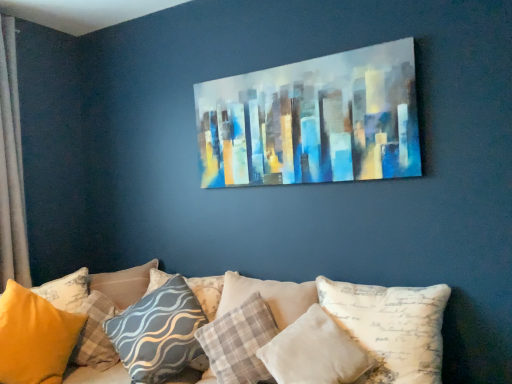
Measure the distance between point (139,360) and camera.

They are 6.73 feet apart.

Find the location of a particular element. Image resolution: width=512 pixels, height=384 pixels. textured gray pillow at center, marked as the 5th pillow in a right-to-left arrangement is located at coordinates (158, 333).

How much space does plaid fabric pillow at center, acting as the 5th pillow starting from the left, occupy horizontally?

plaid fabric pillow at center, acting as the 5th pillow starting from the left, is 17.67 inches wide.

In order to face white velvety pillow at center, arranged as the 6th pillow when viewed from the left, should I rotate leftwards or rightwards?

To align with it, rotate right about 7.085°.

Locate an element on the screen. The image size is (512, 384). white fabric pillow at center, which is the first pillow from right to left is located at coordinates pyautogui.click(x=391, y=327).

Measure the distance between point (371, 314) and camera.

1.84 meters.

Image resolution: width=512 pixels, height=384 pixels. Identify the location of abstract acrylic cityscape at upper center. pos(313,120).

Identify the location of gray wavy-patterned pillow at center, the 4th pillow when ordered from left to right. (207, 292).

Where is `matte yellow pillow at lower left, acting as the seventh pillow starting from the right`? This screenshot has width=512, height=384. matte yellow pillow at lower left, acting as the seventh pillow starting from the right is located at coordinates (87, 319).

How different are the orientations of abstract acrylic cityscape at upper center and yellow fabric pillow at lower left, placed as the sixth pillow when sorted from right to left, in degrees?

The angular difference between abstract acrylic cityscape at upper center and yellow fabric pillow at lower left, placed as the sixth pillow when sorted from right to left, is 30.9 degrees.

From the image's perspective, which object appears higher, abstract acrylic cityscape at upper center or yellow fabric pillow at lower left, placed as the sixth pillow when sorted from right to left?

From the image's view, abstract acrylic cityscape at upper center is above.

Which of these two, abstract acrylic cityscape at upper center or yellow fabric pillow at lower left, which ranks as the second pillow in left-to-right order, is smaller?

Smaller between the two is yellow fabric pillow at lower left, which ranks as the second pillow in left-to-right order.

From the picture: Between abstract acrylic cityscape at upper center and yellow fabric pillow at lower left, which ranks as the second pillow in left-to-right order, which one is positioned in front?

Positioned in front is abstract acrylic cityscape at upper center.

Locate an element on the screen. curtain above the white velvety pillow at center, arranged as the 6th pillow when viewed from the left (from the image's perspective) is located at coordinates (11, 166).

From the image's perspective, is silky beige curtain at left below white velvety pillow at center, arranged as the 6th pillow when viewed from the left?

No.

Is silky beige curtain at left in contact with white velvety pillow at center, arranged as the 6th pillow when viewed from the left?

No, silky beige curtain at left is not making contact with white velvety pillow at center, arranged as the 6th pillow when viewed from the left.

Is silky beige curtain at left taller or shorter than white velvety pillow at center, the second pillow when ordered from right to left?

In the image, silky beige curtain at left appears to be taller than white velvety pillow at center, the second pillow when ordered from right to left.

Is point (128, 338) more distant than point (57, 307)?

No, it is not.

How many degrees apart are the facing directions of textured gray pillow at center, the 3th pillow viewed from the left, and matte yellow pillow at lower left, placed as the first pillow when sorted from left to right?

66.9 degrees.

Based on the photo, from a real-world perspective, is textured gray pillow at center, the 3th pillow viewed from the left, physically located above or below matte yellow pillow at lower left, acting as the seventh pillow starting from the right?

From a real-world perspective, textured gray pillow at center, the 3th pillow viewed from the left, is physically above matte yellow pillow at lower left, acting as the seventh pillow starting from the right.

Between textured gray pillow at center, marked as the 5th pillow in a right-to-left arrangement, and matte yellow pillow at lower left, acting as the seventh pillow starting from the right, which one has larger width?

Wider between the two is matte yellow pillow at lower left, acting as the seventh pillow starting from the right.

Which is closer, (394,41) or (265,314)?

Positioned in front is point (394,41).

You are a GUI agent. You are given a task and a screenshot of the screen. Output one action in this format:
    pyautogui.click(x=<x>, y=<y>)
    Task: Click on the oil painting on the right of plaid fabric pillow at center, acting as the third pillow starting from the right
    This screenshot has width=512, height=384.
    Given the screenshot: What is the action you would take?
    pyautogui.click(x=313, y=120)

Is abstract acrylic cityscape at upper center at the left side of plaid fabric pillow at center, acting as the 5th pillow starting from the left?

No.

Is abstract acrylic cityscape at upper center oriented towards plaid fabric pillow at center, acting as the third pillow starting from the right?

No, abstract acrylic cityscape at upper center does not turn towards plaid fabric pillow at center, acting as the third pillow starting from the right.

From the image's perspective, is plaid fabric pillow at center, acting as the third pillow starting from the right, above or below matte yellow pillow at lower left, placed as the first pillow when sorted from left to right?

From the image's perspective, plaid fabric pillow at center, acting as the third pillow starting from the right, appears above matte yellow pillow at lower left, placed as the first pillow when sorted from left to right.

Between plaid fabric pillow at center, acting as the 5th pillow starting from the left, and matte yellow pillow at lower left, placed as the first pillow when sorted from left to right, which one appears on the left side from the viewer's perspective?

Positioned to the left is matte yellow pillow at lower left, placed as the first pillow when sorted from left to right.

From a real-world perspective, is plaid fabric pillow at center, acting as the 5th pillow starting from the left, physically above matte yellow pillow at lower left, placed as the first pillow when sorted from left to right?

No, from a real-world perspective, plaid fabric pillow at center, acting as the 5th pillow starting from the left, is not over matte yellow pillow at lower left, placed as the first pillow when sorted from left to right

Which object is further away from the camera, gray wavy-patterned pillow at center, the 4th pillow from the right, or abstract acrylic cityscape at upper center?

Positioned behind is gray wavy-patterned pillow at center, the 4th pillow from the right.

Locate an element on the screen. oil painting above the gray wavy-patterned pillow at center, the 4th pillow from the right (from a real-world perspective) is located at coordinates (313, 120).

From the image's perspective, is gray wavy-patterned pillow at center, the 4th pillow from the right, above or below abstract acrylic cityscape at upper center?

Based on their image positions, gray wavy-patterned pillow at center, the 4th pillow from the right, is located beneath abstract acrylic cityscape at upper center.

Is matte yellow pillow at lower left, acting as the seventh pillow starting from the right, far away from white fabric pillow at center, the seventh pillow viewed from the left?

That's right, there is a large distance between matte yellow pillow at lower left, acting as the seventh pillow starting from the right, and white fabric pillow at center, the seventh pillow viewed from the left.

From the image's perspective, is matte yellow pillow at lower left, placed as the first pillow when sorted from left to right, under white fabric pillow at center, which is the first pillow from right to left?

Yes.

From a real-world perspective, between matte yellow pillow at lower left, placed as the first pillow when sorted from left to right, and white fabric pillow at center, the seventh pillow viewed from the left, who is vertically higher?

white fabric pillow at center, the seventh pillow viewed from the left, is physically above.

Does matte yellow pillow at lower left, placed as the first pillow when sorted from left to right, come behind white fabric pillow at center, which is the first pillow from right to left?

That is True.

The height and width of the screenshot is (384, 512). Find the location of `oil painting in front of the yellow fabric pillow at lower left, placed as the sixth pillow when sorted from right to left`. oil painting in front of the yellow fabric pillow at lower left, placed as the sixth pillow when sorted from right to left is located at coordinates (313, 120).

From the image's perspective, count 4th pillows downward from the silky beige curtain at left and point to it. Please provide its 2D coordinates.

[(314, 352)]

From the picture: Looking at the image, which one is located closer to abstract acrylic cityscape at upper center, white velvety pillow at center, the second pillow when ordered from right to left, or white fabric pillow at center, the seventh pillow viewed from the left?

Among the two, white fabric pillow at center, the seventh pillow viewed from the left, is located nearer to abstract acrylic cityscape at upper center.

Based on their spatial positions, is textured gray pillow at center, the 3th pillow viewed from the left, or plaid fabric pillow at center, acting as the third pillow starting from the right, closer to silky beige curtain at left?

textured gray pillow at center, the 3th pillow viewed from the left, is closer to silky beige curtain at left.

From the image, which object appears to be farther from matte yellow pillow at lower left, acting as the seventh pillow starting from the right, white fabric pillow at center, the seventh pillow viewed from the left, or textured gray pillow at center, the 3th pillow viewed from the left?

Among the two, white fabric pillow at center, the seventh pillow viewed from the left, is located further to matte yellow pillow at lower left, acting as the seventh pillow starting from the right.

Based on the photo, estimate the real-world distances between objects in this image. Which object is further from plaid fabric pillow at center, acting as the third pillow starting from the right, yellow fabric pillow at lower left, placed as the sixth pillow when sorted from right to left, or silky beige curtain at left?

silky beige curtain at left lies further to plaid fabric pillow at center, acting as the third pillow starting from the right, than the other object.

From the image, which object appears to be farther from yellow fabric pillow at lower left, placed as the sixth pillow when sorted from right to left, matte yellow pillow at lower left, placed as the first pillow when sorted from left to right, or white velvety pillow at center, the second pillow when ordered from right to left?

Based on the image, white velvety pillow at center, the second pillow when ordered from right to left, appears to be further to yellow fabric pillow at lower left, placed as the sixth pillow when sorted from right to left.

Based on their spatial positions, is abstract acrylic cityscape at upper center or textured gray pillow at center, marked as the 5th pillow in a right-to-left arrangement, closer to white velvety pillow at center, the second pillow when ordered from right to left?

textured gray pillow at center, marked as the 5th pillow in a right-to-left arrangement, lies closer to white velvety pillow at center, the second pillow when ordered from right to left, than the other object.

Considering their positions, is textured gray pillow at center, the 3th pillow viewed from the left, positioned further to white fabric pillow at center, the seventh pillow viewed from the left, than white velvety pillow at center, arranged as the 6th pillow when viewed from the left?

Among the two, textured gray pillow at center, the 3th pillow viewed from the left, is located further to white fabric pillow at center, the seventh pillow viewed from the left.

Based on their spatial positions, is plaid fabric pillow at center, acting as the 5th pillow starting from the left, or matte yellow pillow at lower left, placed as the first pillow when sorted from left to right, further from white velvety pillow at center, arranged as the 6th pillow when viewed from the left?

matte yellow pillow at lower left, placed as the first pillow when sorted from left to right, is positioned further to the anchor white velvety pillow at center, arranged as the 6th pillow when viewed from the left.

Locate an element on the screen. oil painting between yellow fabric pillow at lower left, which ranks as the second pillow in left-to-right order, and white fabric pillow at center, the seventh pillow viewed from the left, from left to right is located at coordinates (313, 120).

At what (x,y) coordinates should I click in order to perform the action: click on pillow between yellow fabric pillow at lower left, placed as the sixth pillow when sorted from right to left, and gray wavy-patterned pillow at center, the 4th pillow when ordered from left to right, from left to right. Please return your answer as a coordinate pair (x, y). Image resolution: width=512 pixels, height=384 pixels. Looking at the image, I should click on (158, 333).

The image size is (512, 384). Identify the location of pillow between matte yellow pillow at lower left, placed as the first pillow when sorted from left to right, and textured gray pillow at center, marked as the 5th pillow in a right-to-left arrangement. (95, 334).

Find the location of a particular element. The height and width of the screenshot is (384, 512). oil painting between matte yellow pillow at lower left, placed as the first pillow when sorted from left to right, and white fabric pillow at center, the seventh pillow viewed from the left is located at coordinates (313, 120).